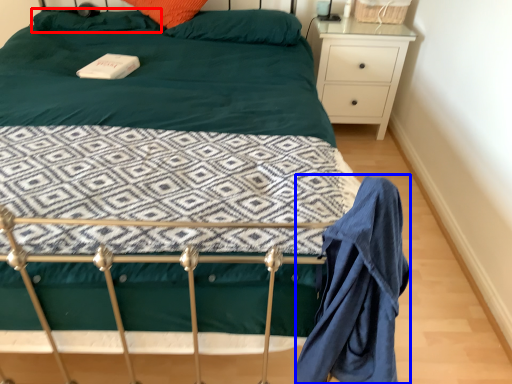
Question: Which of the following is the farthest to the observer, pillow (highlighted by a red box) or robe (highlighted by a blue box)?

Choices:
 (A) pillow
 (B) robe

Answer: (A)